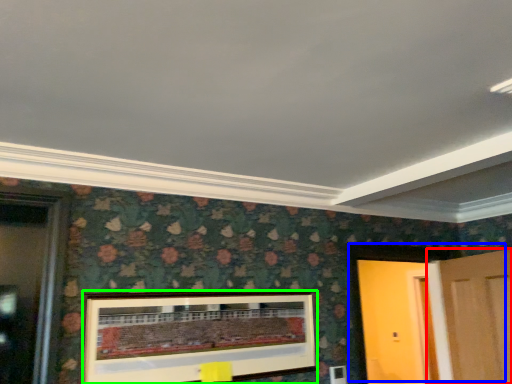
Question: Based on their relative distances, which object is farther from door (highlighted by a red box)? Choose from door (highlighted by a blue box) and picture frame (highlighted by a green box).

Choices:
 (A) door
 (B) picture frame

Answer: (B)